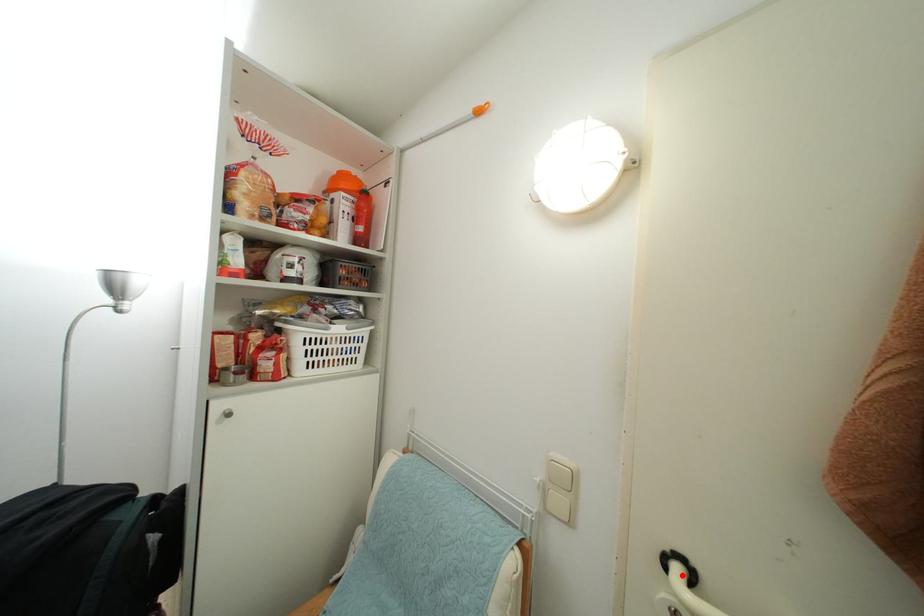
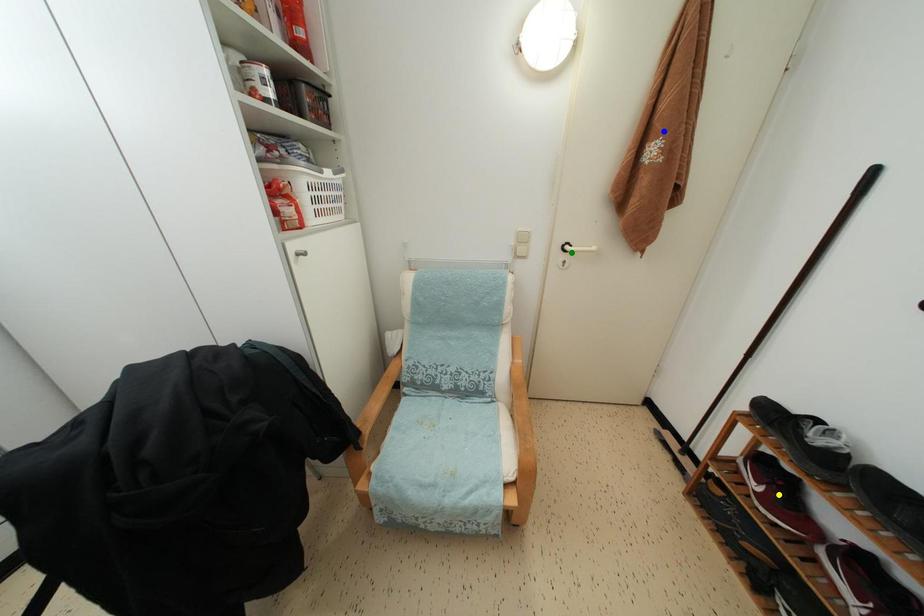
Question: I am providing you with two images of the same scene from different viewpoints. A red point is marked on the first image. You are given multiple points on the second image. Which point in image 2 represents the same 3d spot as the red point in image 1?

Choices:
 (A) blue point
 (B) yellow point
 (C) green point

Answer: (C)